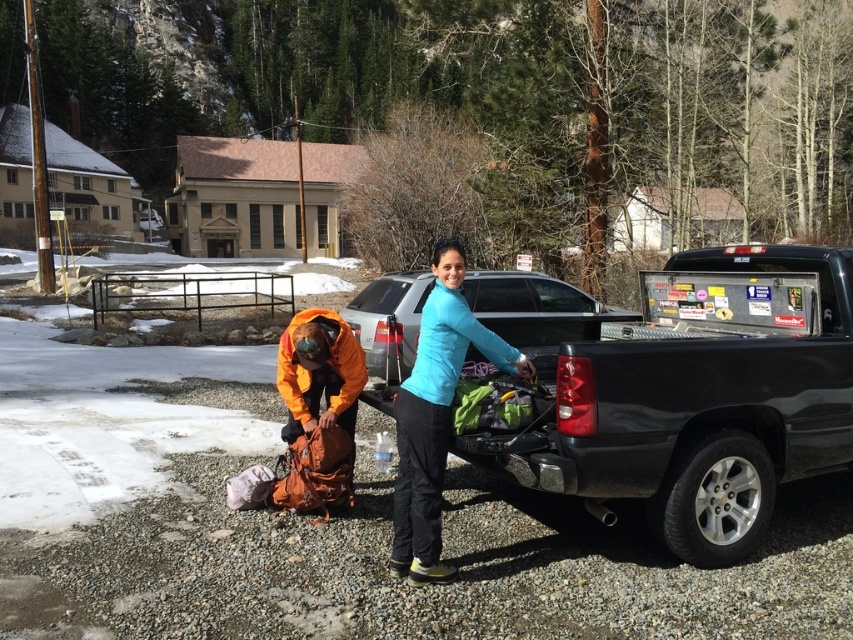
Question: Is matte black truck bed at center bigger than blue matte jacket at center?

Choices:
 (A) no
 (B) yes

Answer: (B)

Question: Among these objects, which one is nearest to the camera?

Choices:
 (A) matte black truck bed at center
 (B) blue matte jacket at center

Answer: (A)

Question: Which point is farther to the camera?

Choices:
 (A) blue matte jacket at center
 (B) matte black truck bed at center

Answer: (A)

Question: Is matte black truck bed at center above blue matte jacket at center?

Choices:
 (A) yes
 (B) no

Answer: (A)

Question: Does matte black truck bed at center appear on the left side of blue matte jacket at center?

Choices:
 (A) yes
 (B) no

Answer: (B)